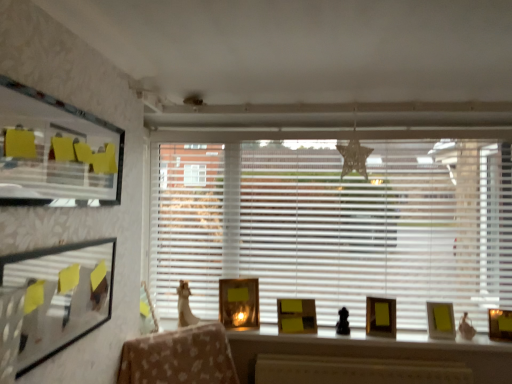
Question: Does matte gold picture frame at right, placed as the third picture frame when sorted from back to front, have a larger size compared to matte gold picture frame at right, arranged as the second picture frame when viewed from the front?

Choices:
 (A) no
 (B) yes

Answer: (B)

Question: From a real-world perspective, is matte gold picture frame at right, the second picture frame viewed from the right, physically below matte gold picture frame at right, arranged as the second picture frame when viewed from the front?

Choices:
 (A) yes
 (B) no

Answer: (B)

Question: Is matte gold picture frame at right, the second picture frame viewed from the right, further to the viewer compared to matte gold picture frame at right, arranged as the second picture frame when viewed from the front?

Choices:
 (A) no
 (B) yes

Answer: (B)

Question: Can you confirm if matte gold picture frame at right, the second picture frame viewed from the right, is wider than matte gold picture frame at right, the first picture frame from the right?

Choices:
 (A) no
 (B) yes

Answer: (B)

Question: Is matte gold picture frame at right, placed as the 5th picture frame when sorted from back to front, located within matte gold picture frame at right, the fifth picture frame when ordered from left to right?

Choices:
 (A) no
 (B) yes

Answer: (A)

Question: From the image's perspective, does matte gold picture frame at right, the fifth picture frame when ordered from left to right, appear lower than matte gold picture frame at right, placed as the 5th picture frame when sorted from back to front?

Choices:
 (A) yes
 (B) no

Answer: (B)

Question: Does white plastic blinds at center have a smaller size compared to matte gold picture frame at right, the first picture frame from the right?

Choices:
 (A) yes
 (B) no

Answer: (B)

Question: Is white plastic blinds at center thinner than matte gold picture frame at right, placed as the 5th picture frame when sorted from back to front?

Choices:
 (A) yes
 (B) no

Answer: (A)

Question: Is white plastic blinds at center positioned before matte gold picture frame at right, arranged as the second picture frame when viewed from the front?

Choices:
 (A) no
 (B) yes

Answer: (A)

Question: Does white plastic blinds at center have a greater height compared to matte gold picture frame at right, the sixth picture frame viewed from the left?

Choices:
 (A) yes
 (B) no

Answer: (A)

Question: Is white plastic blinds at center shorter than matte gold picture frame at right, the sixth picture frame viewed from the left?

Choices:
 (A) yes
 (B) no

Answer: (B)

Question: Could you tell me if white plastic blinds at center is facing matte gold picture frame at right, placed as the 5th picture frame when sorted from back to front?

Choices:
 (A) no
 (B) yes

Answer: (B)

Question: Considering the relative sizes of gold metallic picture frame at center, arranged as the 6th picture frame when viewed from the front, and matte gold picture frame at right, the sixth picture frame viewed from the left, in the image provided, is gold metallic picture frame at center, arranged as the 6th picture frame when viewed from the front, wider than matte gold picture frame at right, the sixth picture frame viewed from the left,?

Choices:
 (A) no
 (B) yes

Answer: (B)